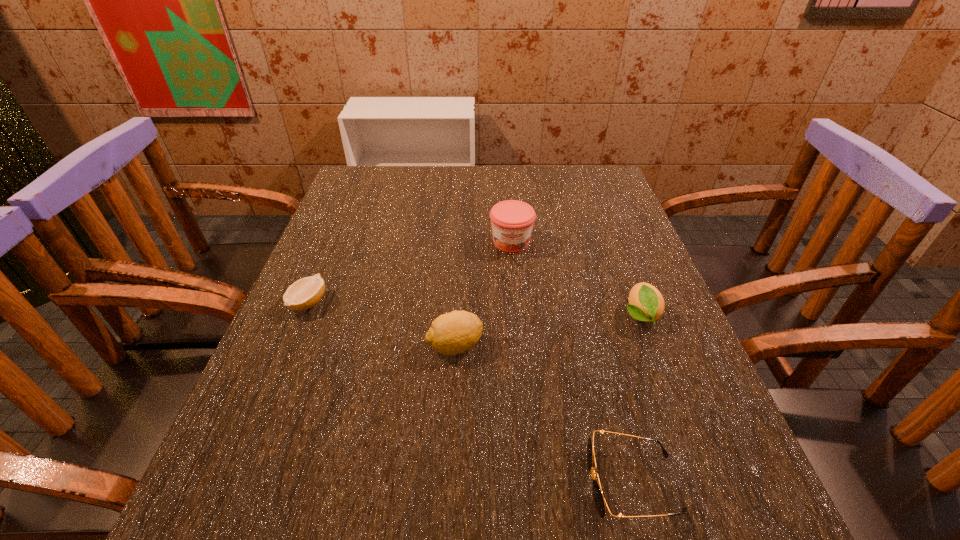
Where is `free spot that satisfies the following two spatial constraints: 1. with leaves positioned above the rightmost object; 2. on the front-facing side of the sunglasses`? Image resolution: width=960 pixels, height=540 pixels. free spot that satisfies the following two spatial constraints: 1. with leaves positioned above the rightmost object; 2. on the front-facing side of the sunglasses is located at coordinates (704, 483).

Identify the location of vacant space that satisfies the following two spatial constraints: 1. with leaves positioned above the rightmost lemon; 2. at the stem end of the second lemon from right to left. The image size is (960, 540). (652, 346).

Locate an element on the screen. vacant space that satisfies the following two spatial constraints: 1. on the front label of the tallest object; 2. at the stem end of the second lemon from right to left is located at coordinates (520, 346).